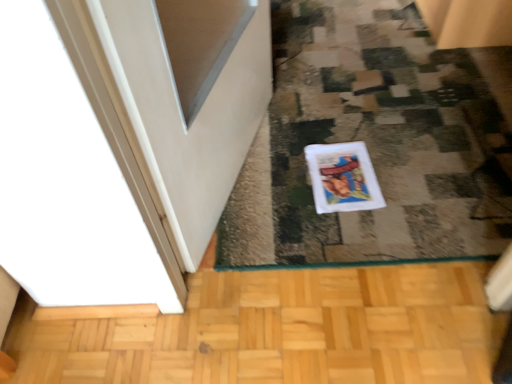
Question: Is white fabric doormat at center wider or thinner than white matte comic book at center?

Choices:
 (A) wide
 (B) thin

Answer: (A)

Question: Considering their positions, is white fabric doormat at center located in front of or behind white matte comic book at center?

Choices:
 (A) behind
 (B) front

Answer: (B)

Question: Is point (366, 109) positioned closer to the camera than point (364, 147)?

Choices:
 (A) farther
 (B) closer

Answer: (A)

Question: Is white matte comic book at center in front of or behind white fabric doormat at center in the image?

Choices:
 (A) front
 (B) behind

Answer: (B)

Question: From the image's perspective, relative to white fabric doormat at center, is white matte comic book at center above or below?

Choices:
 (A) above
 (B) below

Answer: (B)

Question: Would you say white matte comic book at center is inside or outside white fabric doormat at center?

Choices:
 (A) inside
 (B) outside

Answer: (A)

Question: Considering the positions of white matte comic book at center and white fabric doormat at center in the image, is white matte comic book at center wider or thinner than white fabric doormat at center?

Choices:
 (A) wide
 (B) thin

Answer: (B)